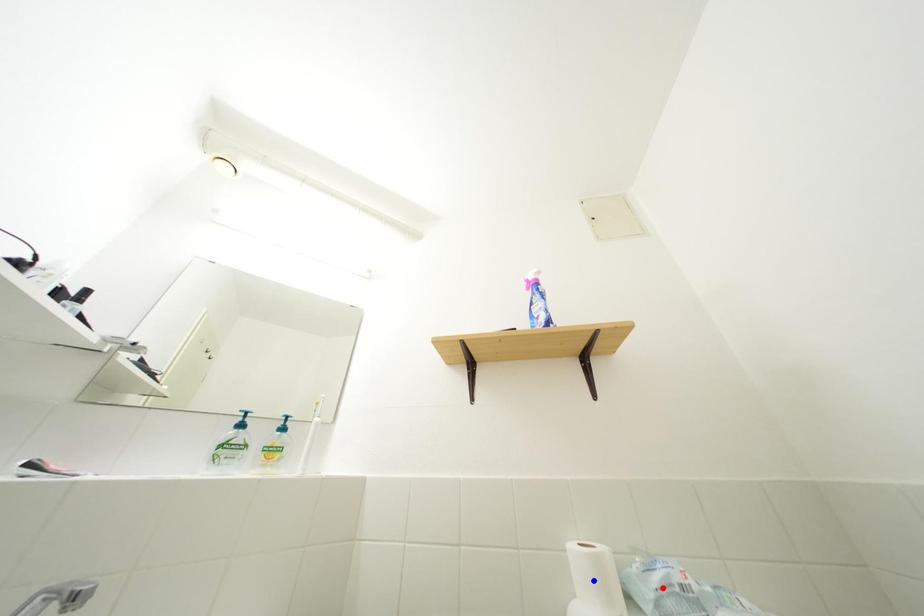
Question: Two points are marked on the image. Which point is closer to the camera?

Choices:
 (A) Blue point is closer.
 (B) Red point is closer.

Answer: (B)